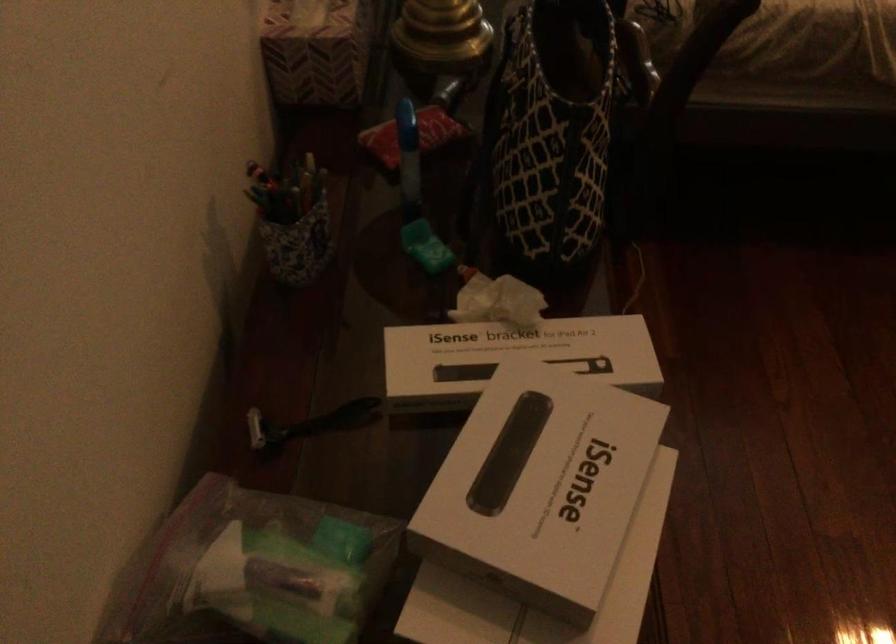
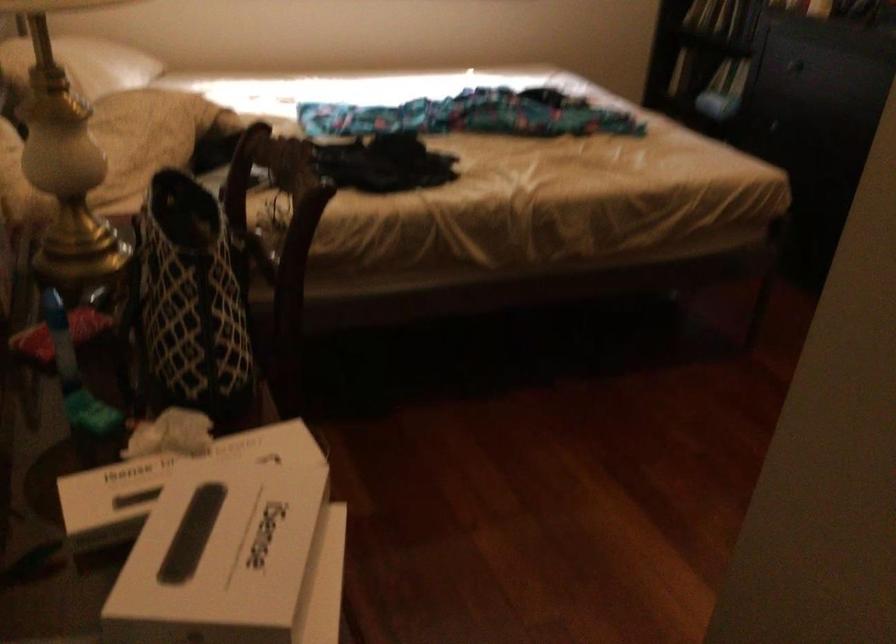
Where in the second image is the point corresponding to (552,158) from the first image?

(188, 301)